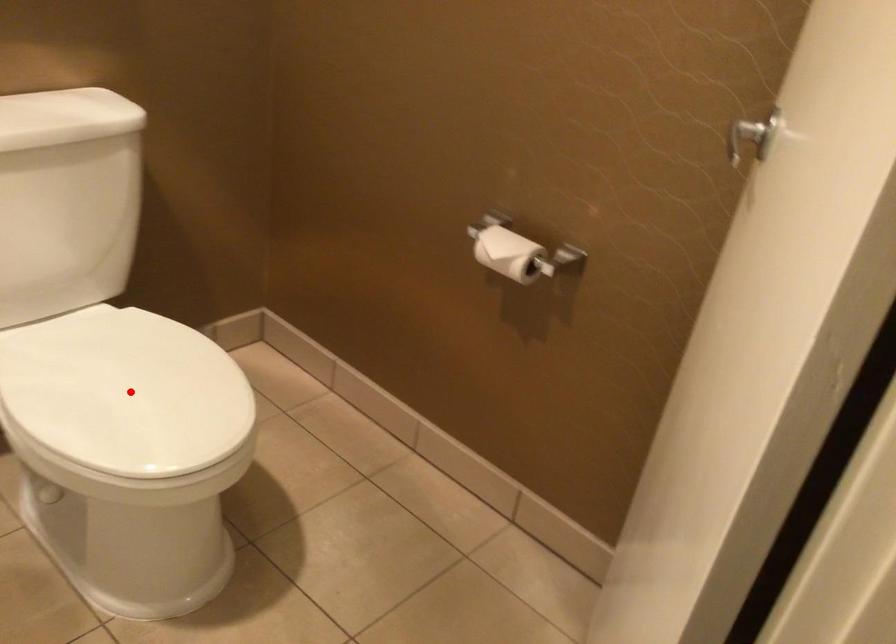
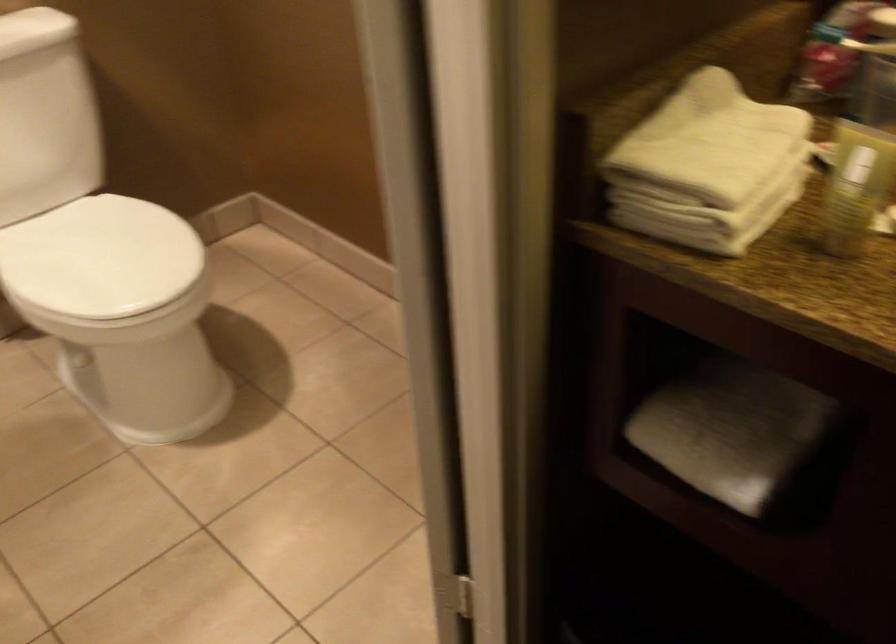
Question: I am providing you with two images of the same scene from different viewpoints. A red point is shown in image1. For the corresponding object point in image2, is it positioned nearer or farther from the camera?

Choices:
 (A) Nearer
 (B) Farther

Answer: (B)